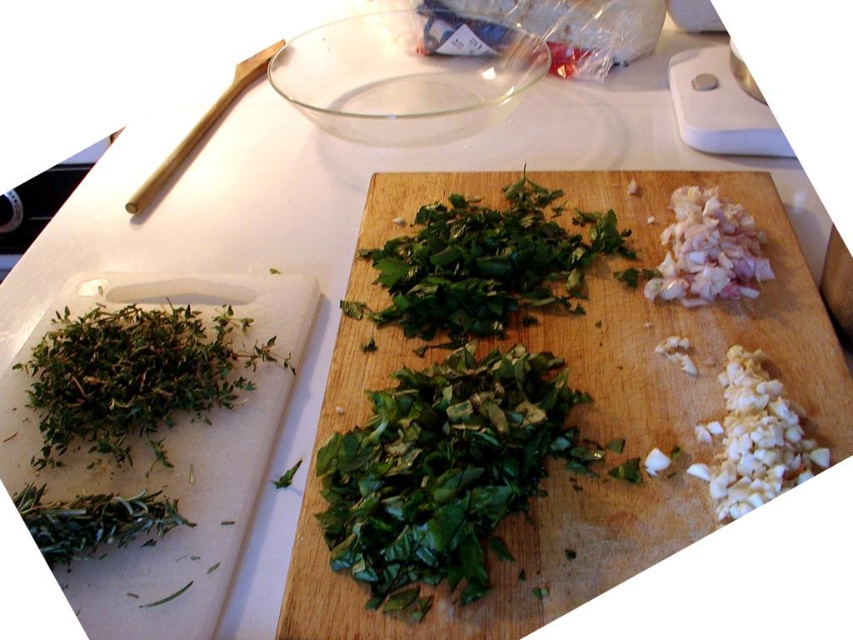
Question: Which object is the closest to the green leafy at center?

Choices:
 (A) green leafy herb at left
 (B) white diced garlic at upper right

Answer: (B)

Question: Is green leafy herbs at center behind green leafy herb at left?

Choices:
 (A) yes
 (B) no

Answer: (B)

Question: Which object appears farthest from the camera in this image?

Choices:
 (A) white diced garlic at upper right
 (B) green leafy at center

Answer: (A)

Question: Does green leafy herb at left appear over white diced garlic at upper right?

Choices:
 (A) yes
 (B) no

Answer: (B)

Question: Can you confirm if green leafy herbs at center is smaller than white diced garlic at upper right?

Choices:
 (A) no
 (B) yes

Answer: (A)

Question: Which is nearer to the green leafy herbs at center?

Choices:
 (A) green leafy at center
 (B) white diced garlic at upper right

Answer: (A)